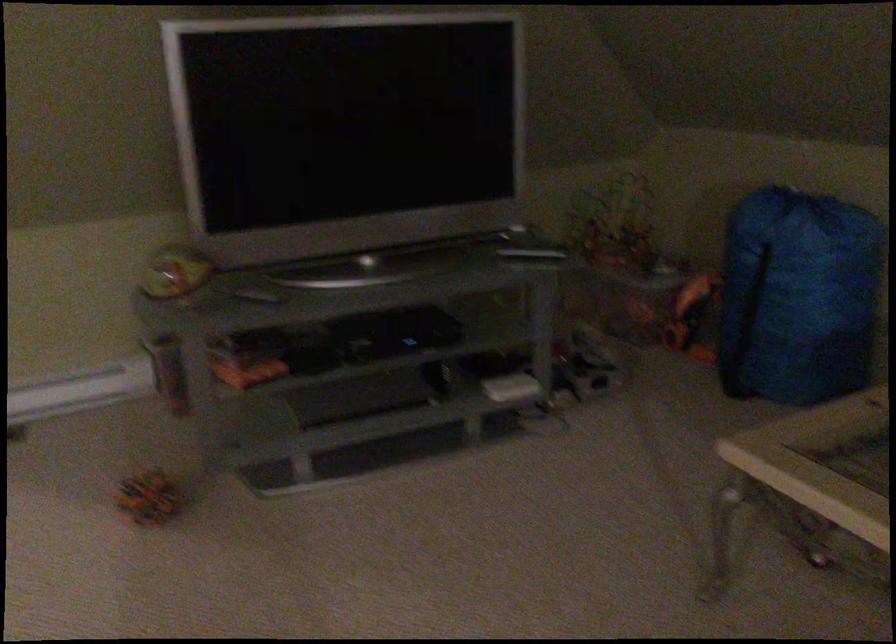
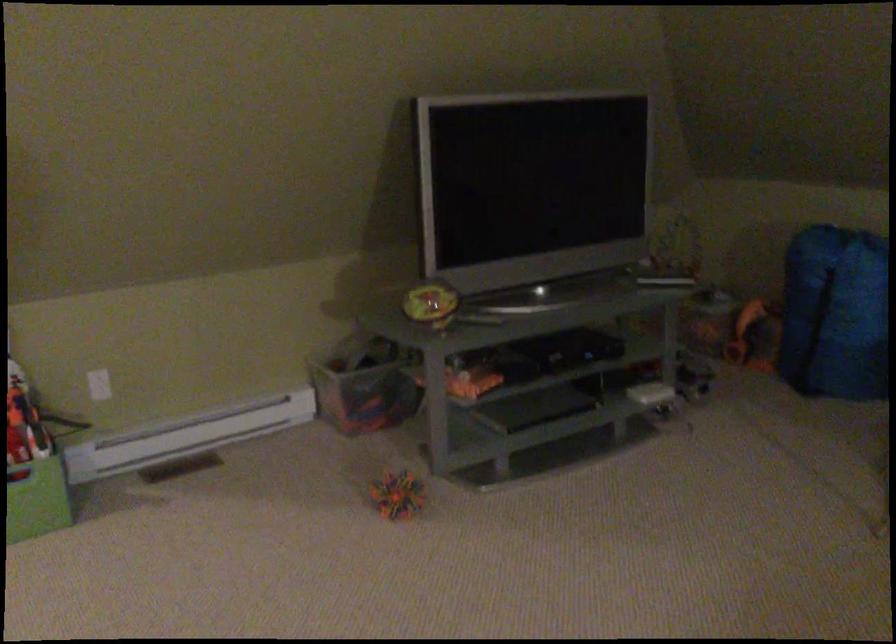
Locate, in the second image, the point that corresponds to (672,319) in the first image.

(754, 336)